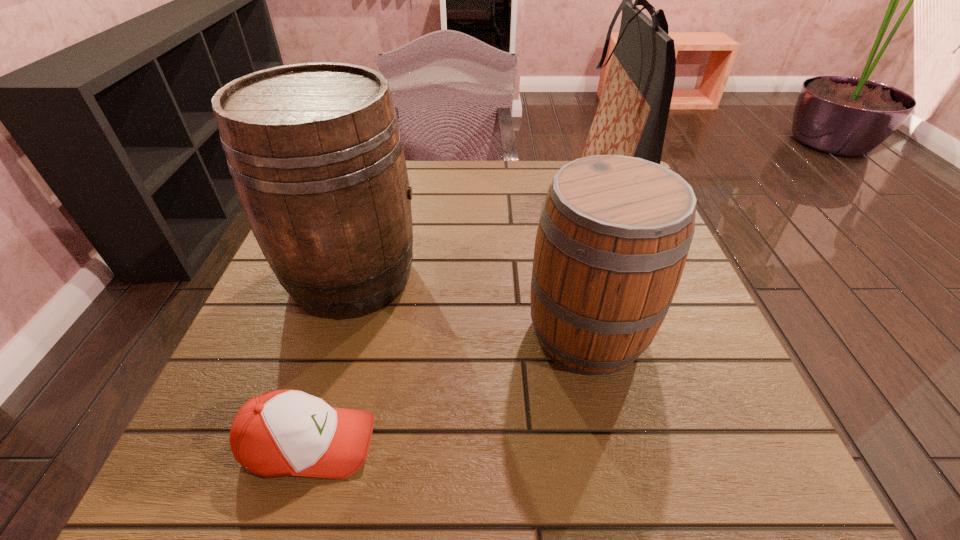
I want to click on object at the far right corner, so click(631, 118).

You are a GUI agent. You are given a task and a screenshot of the screen. Output one action in this format:
    pyautogui.click(x=<x>, y=<y>)
    Task: Click on the vacant space at the far edge of the desktop
    
    Given the screenshot: What is the action you would take?
    pyautogui.click(x=496, y=192)

Where is `vacant space at the near edge of the desktop`? The image size is (960, 540). vacant space at the near edge of the desktop is located at coordinates (426, 444).

The image size is (960, 540). What are the coordinates of `vacant space at the right edge of the desktop` in the screenshot? It's located at (658, 336).

Where is `free spot between the farthest object and the second tallest object`? This screenshot has height=540, width=960. free spot between the farthest object and the second tallest object is located at coordinates (481, 234).

Locate an element on the screen. The image size is (960, 540). empty location between the second shortest object and the second tallest object is located at coordinates (469, 305).

Where is `free point between the right cider and the taller cider`? The width and height of the screenshot is (960, 540). free point between the right cider and the taller cider is located at coordinates (469, 305).

The height and width of the screenshot is (540, 960). Identify the location of vacant space in between the taller cider and the shorter cider. (469, 305).

The width and height of the screenshot is (960, 540). What are the coordinates of `vacant point located between the taller cider and the nearest object` in the screenshot? It's located at (331, 360).

Locate an element on the screen. vacant area between the shopping bag and the left cider is located at coordinates (481, 234).